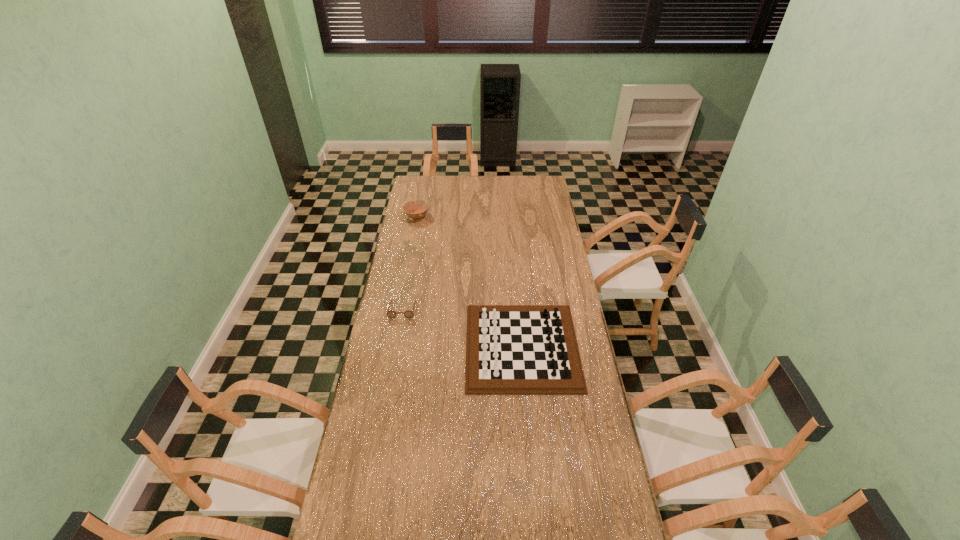
Where is `the rightmost object`? This screenshot has width=960, height=540. the rightmost object is located at coordinates (510, 349).

Where is `the tallest object`? Image resolution: width=960 pixels, height=540 pixels. the tallest object is located at coordinates (510, 349).

Where is `the farthest object`? The height and width of the screenshot is (540, 960). the farthest object is located at coordinates (421, 206).

At what (x,y) coordinates should I click in order to perform the action: click on the second shortest object. Please return your answer as a coordinate pair (x, y). Image resolution: width=960 pixels, height=540 pixels. Looking at the image, I should click on (421, 206).

The width and height of the screenshot is (960, 540). Find the location of `the shortest object`. the shortest object is located at coordinates [x=391, y=314].

Where is `free space located 0.200m on the front of the tallest object`? The image size is (960, 540). free space located 0.200m on the front of the tallest object is located at coordinates (531, 444).

This screenshot has width=960, height=540. I want to click on vacant space located 0.160m on the right of the bowl, so click(x=457, y=216).

Image resolution: width=960 pixels, height=540 pixels. Identify the location of vacant space positioned on the front-facing side of the spectacles. (391, 373).

The height and width of the screenshot is (540, 960). In order to click on bowl at the left edge in this screenshot , I will do `click(421, 206)`.

The height and width of the screenshot is (540, 960). I want to click on spectacles that is at the left edge, so click(x=391, y=314).